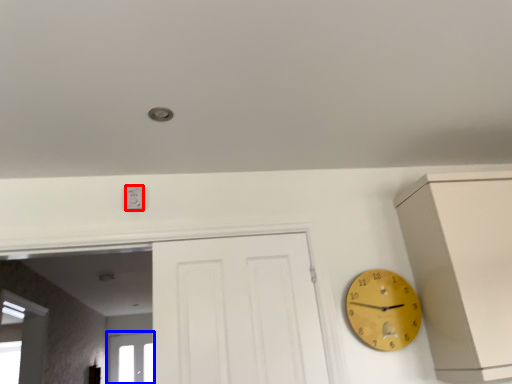
Question: Which point is closer to the camera, electric outlet (highlighted by a red box) or window (highlighted by a blue box)?

Choices:
 (A) electric outlet
 (B) window

Answer: (A)